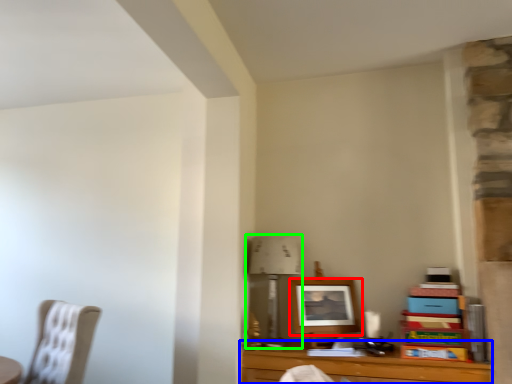
Question: Which object is the farthest from picture frame (highlighted by a red box)? Choose among these: table (highlighted by a blue box) or table lamp (highlighted by a green box).

Choices:
 (A) table
 (B) table lamp

Answer: (A)